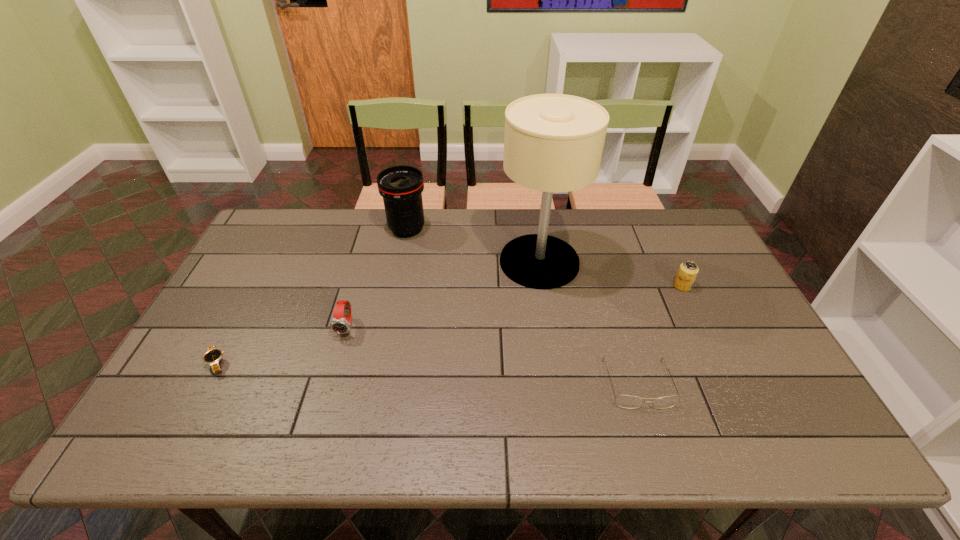
Locate an element on the screen. The width and height of the screenshot is (960, 540). vacant region between the farther watch and the left watch is located at coordinates (282, 345).

Identify the location of vacant space in between the beer can and the nearer watch. This screenshot has width=960, height=540. click(449, 325).

What are the coordinates of `vacant space that is in between the table lamp and the beer can` in the screenshot? It's located at (611, 274).

The width and height of the screenshot is (960, 540). Find the location of `free space between the tallest object and the spectacles`. free space between the tallest object and the spectacles is located at coordinates (589, 323).

Find the location of a particular element. free space between the beer can and the second shortest object is located at coordinates (660, 335).

Locate an element on the screen. The height and width of the screenshot is (540, 960). free space between the second shortest object and the third object from left to right is located at coordinates (523, 307).

You are a GUI agent. You are given a task and a screenshot of the screen. Output one action in this format:
    pyautogui.click(x=<x>, y=<y>)
    Task: Click on the object that is the nearest to the farther watch
    The height and width of the screenshot is (540, 960).
    Given the screenshot: What is the action you would take?
    pyautogui.click(x=213, y=356)

The image size is (960, 540). I want to click on the fifth closest object relative to the table lamp, so click(x=213, y=356).

At what (x,y) coordinates should I click in order to perform the action: click on vacant space that satisfies the following two spatial constraints: 1. on the front side of the table lamp; 2. on the right side of the rightmost object. Please return your answer as a coordinate pair (x, y). Looking at the image, I should click on (543, 286).